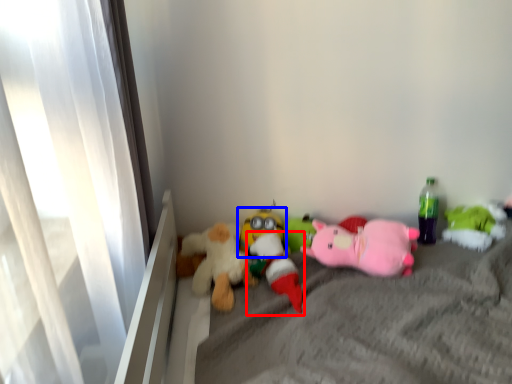
Question: Which object is closer to the camera taking this photo, toy (highlighted by a red box) or toy (highlighted by a blue box)?

Choices:
 (A) toy
 (B) toy

Answer: (A)